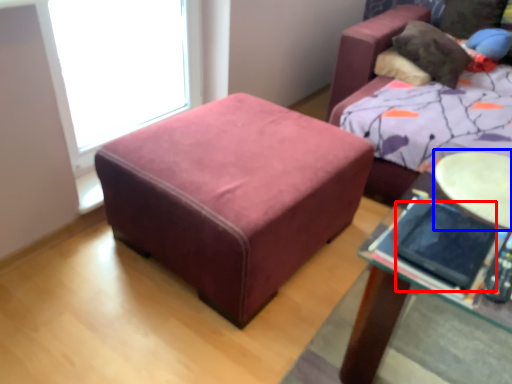
Question: Which object appears farthest to the camera in this image, ipad (highlighted by a red box) or round table (highlighted by a blue box)?

Choices:
 (A) ipad
 (B) round table

Answer: (B)